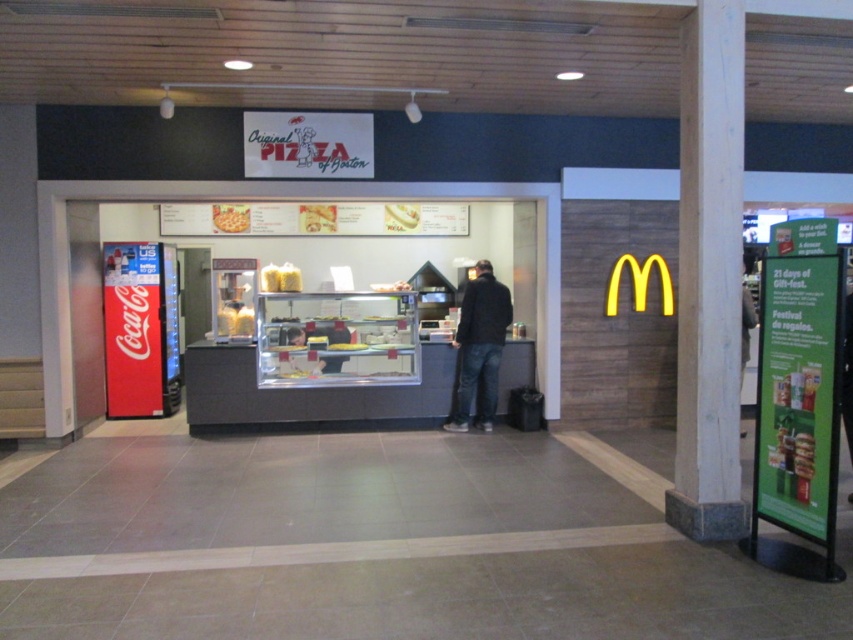
You are a food court manager checking the layout. You need to place a new 12cm wide promotional banner between the white wood pillar at center right and the white glossy bread at center. Can the banner fit without overlapping either object?

The white wood pillar at center right is thinner than the white glossy bread at center. Since the banner is 12cm wide, it can fit between them as long as the space between the pillar and the bread is at least 12cm. However, the exact distance isn not provided, so we cannot confirm without measuring.

You are a customer in this food court and want to place an order for the white glossy bread at center. However, there is a white wood pillar at center right blocking your path. Can you walk around the pillar to reach the bread?

The white wood pillar at center right is larger in size than white glossy bread at center, so it will block your path. You can walk around the pillar to reach the white glossy bread at center since pillars are typically passable obstacles.